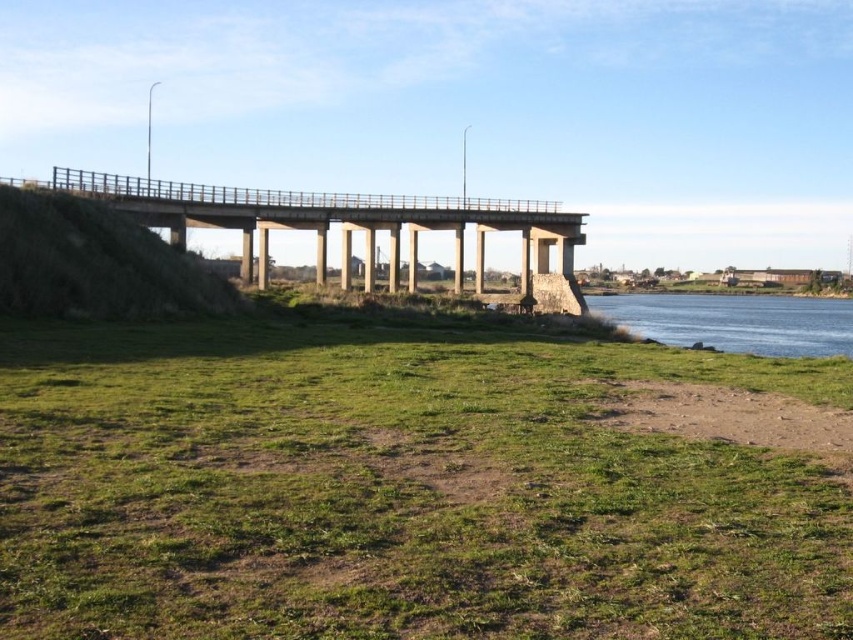
Question: Which of these objects is positioned farthest from the concrete bridge at center?

Choices:
 (A) dirt ground at lower right
 (B) green grassy at lower center

Answer: (A)

Question: Which of the following is the farthest from the observer?

Choices:
 (A) (543, 282)
 (B) (729, 419)

Answer: (A)

Question: Can you confirm if green grassy at lower center is bigger than dirt ground at lower right?

Choices:
 (A) no
 (B) yes

Answer: (B)

Question: Does green grassy at lower center have a smaller size compared to concrete bridge at center?

Choices:
 (A) yes
 (B) no

Answer: (A)

Question: Estimate the real-world distances between objects in this image. Which object is farther from the green grassy at lower center?

Choices:
 (A) concrete bridge at center
 (B) dirt ground at lower right

Answer: (A)

Question: Is concrete bridge at center wider than dirt ground at lower right?

Choices:
 (A) yes
 (B) no

Answer: (A)